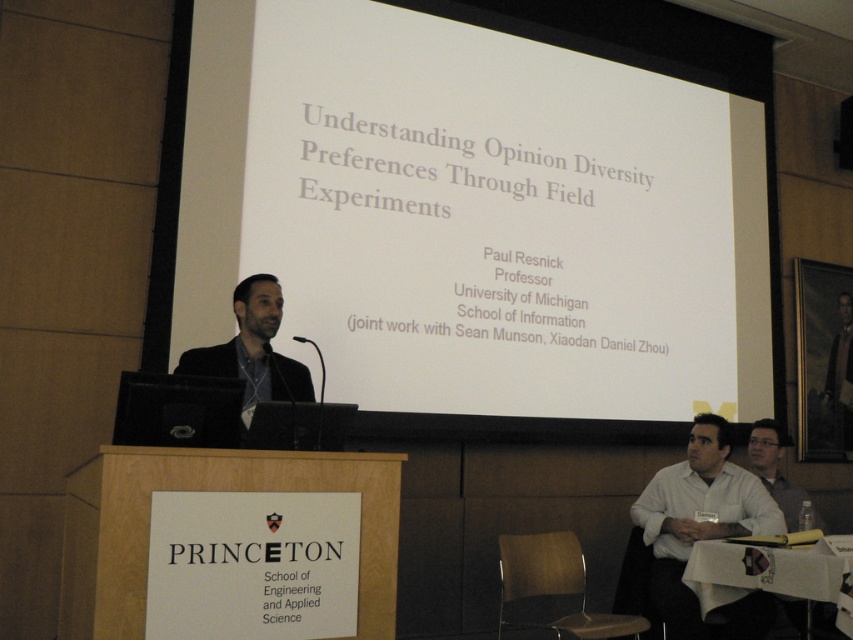
Does white matte projection screen at upper center have a larger size compared to white shirt at lower right?

Yes, white matte projection screen at upper center is bigger than white shirt at lower right.

Who is lower down, white matte projection screen at upper center or white shirt at lower right?

white shirt at lower right is lower down.

Find the location of `white matte projection screen at upper center`. white matte projection screen at upper center is located at coordinates (488, 209).

Is white matte projection screen at upper center above dark suit at center?

Correct, white matte projection screen at upper center is located above dark suit at center.

What are the coordinates of `white matte projection screen at upper center` in the screenshot? It's located at pyautogui.click(x=488, y=209).

In the scene shown: Who is more forward, [587,328] or [210,364]?

Point [210,364]

Image resolution: width=853 pixels, height=640 pixels. I want to click on white matte projection screen at upper center, so click(488, 209).

Who is lower down, white shirt at lower right or dark suit at center?

white shirt at lower right

Who is positioned more to the left, white shirt at lower right or dark suit at center?

Positioned to the left is dark suit at center.

Is point (698, 609) more distant than point (276, 332)?

Yes.

This screenshot has width=853, height=640. Identify the location of white shirt at lower right. (703, 531).